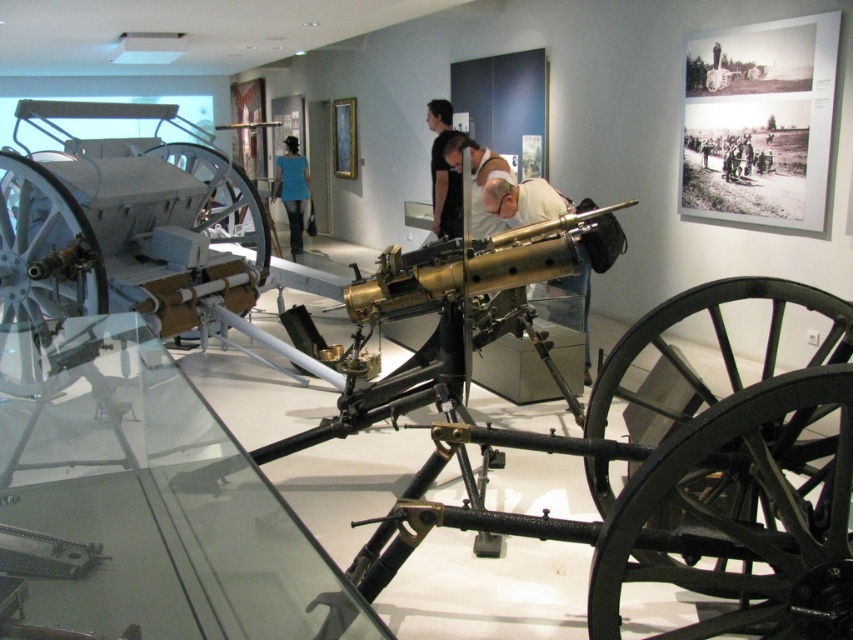
You are a visitor in the museum and want to take a photo of the exhibit. You notice two points marked in the scene. Point A is at coordinates point [376,637] and Point B is at point [733,148]. Which point is closer to the camera lens to ensure the best focus?

Point A at point [376,637] is closer to the camera lens because it is in front of point B at point [733,148]. To ensure the best focus, aim the camera towards Point A.

You are a museum visitor standing in front of the transparent glass table at center and the brown leather jacket at center. Which object is located to the left of the other?

The transparent glass table at center is positioned on the left side of brown leather jacket at center, so the transparent glass table at center is to the left of the brown leather jacket at center.

You are a security guard in the museum and notice the brown leather jacket at center on top of the transparent glass table at center. Is the jacket covering the table or is the table covering the jacket?

The transparent glass table at center is positioned under brown leather jacket at center, so the table is covering the jacket.